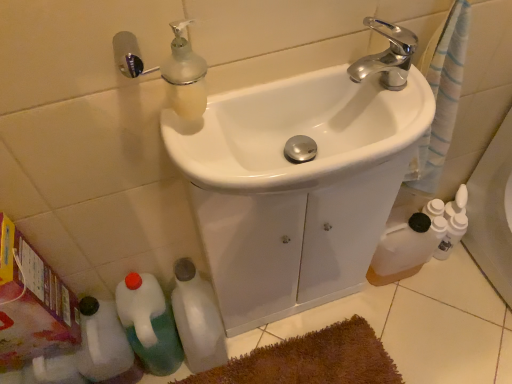
Question: Looking at the image, does white matte bottle at lower left, which is the 3th bottle from left to right, seem bigger or smaller compared to brown plush bath mat at lower center?

Choices:
 (A) big
 (B) small

Answer: (A)

Question: Considering the positions of white matte bottle at lower left, which is the 1th bottle in right-to-left order, and brown plush bath mat at lower center in the image, is white matte bottle at lower left, which is the 1th bottle in right-to-left order, wider or thinner than brown plush bath mat at lower center?

Choices:
 (A) thin
 (B) wide

Answer: (A)

Question: Considering the real-world distances, which object is closest to the white plastic bottle at lower left, which appears as the third bottle when viewed from the right?

Choices:
 (A) white glossy sink at center, the 1th sink when ordered from back to front
 (B) brown plush bath mat at lower center
 (C) white matte bottle at lower left, which is the 3th bottle from left to right
 (D) white glossy sink at center, the 2th sink viewed from the back
 (E) green plastic bottle at lower left, the second bottle viewed from the left

Answer: (E)

Question: Which is nearer to the white plastic bottle at lower left, which appears as the third bottle when viewed from the right?

Choices:
 (A) brown plush bath mat at lower center
 (B) white matte bottle at lower left, which is the 3th bottle from left to right
 (C) white glossy sink at center, the 2th sink viewed from the front
 (D) green plastic bottle at lower left, the second bottle viewed from the left
 (E) white glossy sink at center, positioned as the first sink in front-to-back order

Answer: (D)